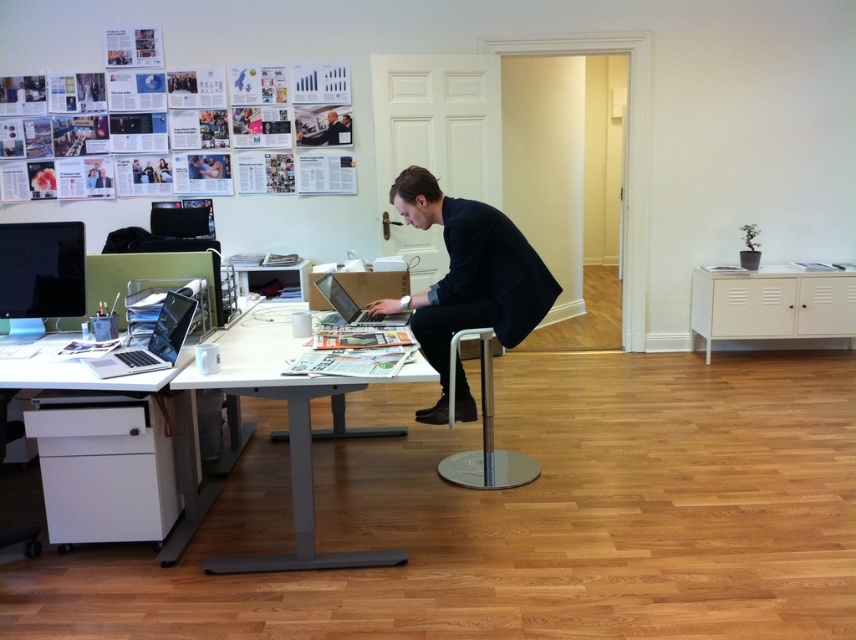
You are standing at the point labeled as point (58, 371) in the office. If you want to move towards the camera, which direction should you walk?

Since the point (58, 371) is 8.51 feet away from the camera, you should walk towards the camera in the direction opposite to the filing cabinet, as the camera is positioned to capture the scene from the right side of the desk where the man is working.

You are an office worker who needs to place a new document organizer on the desk. The organizer is 20 cm wide. The desk is 1.2 meters wide. Can the organizer fit on the white plastic desk at center if it is placed between the silver metallic laptop at left and the edge of the desk?

The white plastic desk at center is 1.2 meters wide, so the organizer which is 20 cm wide can easily fit on the desk between the silver metallic laptop at left and the edge of the desk.